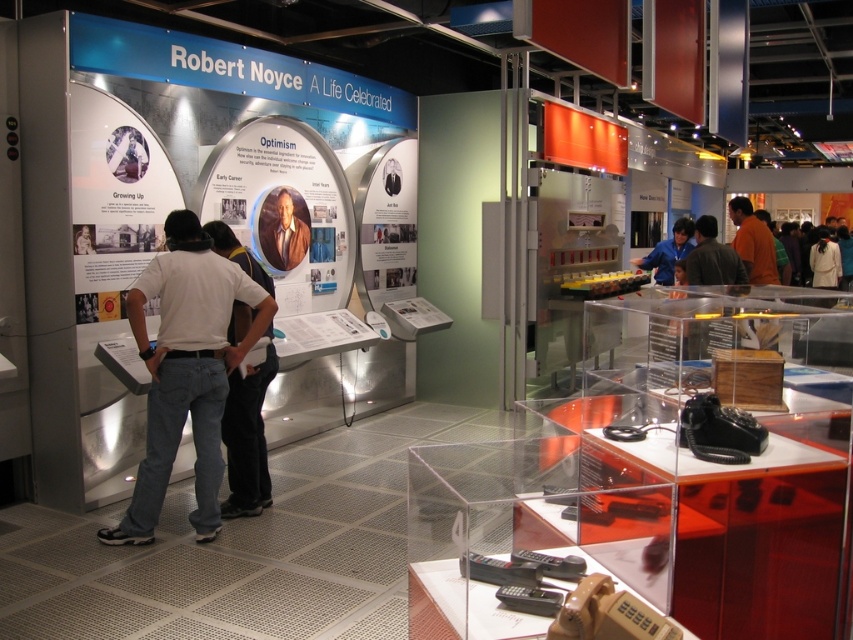
Does point (260, 237) lie in front of point (682, 221)?

Yes, it is.

Does matte brown suit at center come behind blue shirt at center?

No, it is not.

Image resolution: width=853 pixels, height=640 pixels. I want to click on matte brown suit at center, so click(283, 227).

The height and width of the screenshot is (640, 853). In order to click on white matte shirt at left in this screenshot , I will do `click(186, 371)`.

Is white matte shirt at left to the left of orange shirt at right from the viewer's perspective?

Correct, you'll find white matte shirt at left to the left of orange shirt at right.

You are a GUI agent. You are given a task and a screenshot of the screen. Output one action in this format:
    pyautogui.click(x=<x>, y=<y>)
    Task: Click on the white matte shirt at left
    
    Given the screenshot: What is the action you would take?
    pyautogui.click(x=186, y=371)

Does matte silver poster at center have a greater width compared to blue shirt at center?

No, matte silver poster at center is not wider than blue shirt at center.

Between point (403, 200) and point (669, 257), which one is positioned in front?

Positioned in front is point (403, 200).

Find the location of a particular element. This screenshot has width=853, height=640. matte silver poster at center is located at coordinates (387, 225).

Identify the location of matte silver poster at center. The width and height of the screenshot is (853, 640). (387, 225).